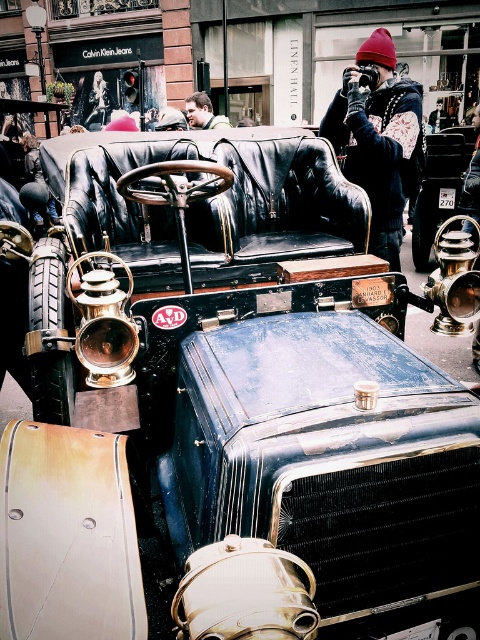
Looking at this image, between red knit beanie at upper center and smooth skin face at upper center, which one appears on the right side from the viewer's perspective?

Positioned to the right is red knit beanie at upper center.

Which is more to the left, red knit beanie at upper center or smooth skin face at upper center?

smooth skin face at upper center is more to the left.

The height and width of the screenshot is (640, 480). I want to click on red knit beanie at upper center, so click(380, 140).

This screenshot has width=480, height=640. I want to click on red knit beanie at upper center, so click(x=380, y=140).